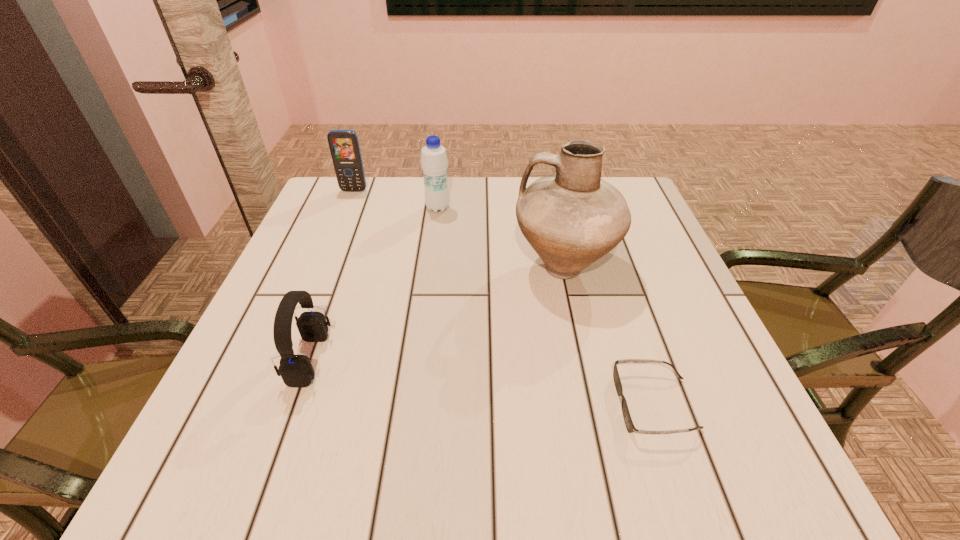
Locate an element on the screen. free space between the third farthest object and the third object from right to left is located at coordinates (501, 238).

Find the location of a particular element. This screenshot has height=540, width=960. free space between the third nearest object and the third object from left to right is located at coordinates (501, 238).

The height and width of the screenshot is (540, 960). Find the location of `unoccupied position between the farthest object and the pitcher`. unoccupied position between the farthest object and the pitcher is located at coordinates (459, 228).

I want to click on vacant point located between the second farthest object and the second shortest object, so click(x=373, y=284).

In order to click on vacant area that lies between the water bottle and the fourth tallest object in this screenshot , I will do (x=373, y=284).

Find the location of `empty space between the farthest object and the water bottle`. empty space between the farthest object and the water bottle is located at coordinates (396, 199).

You are a GUI agent. You are given a task and a screenshot of the screen. Output one action in this format:
    pyautogui.click(x=<x>, y=<y>)
    Task: Click on the vacant space that is in between the sunglasses and the tallest object
    The height and width of the screenshot is (540, 960).
    Given the screenshot: What is the action you would take?
    pyautogui.click(x=610, y=335)

The width and height of the screenshot is (960, 540). Identify the location of empty space that is in between the sunglasses and the second farthest object. (546, 306).

Where is `vacant area between the tallest object and the shortest object`? vacant area between the tallest object and the shortest object is located at coordinates (610, 335).

Locate an element on the screen. vacant area that lies between the third object from left to right and the cellular telephone is located at coordinates (396, 199).